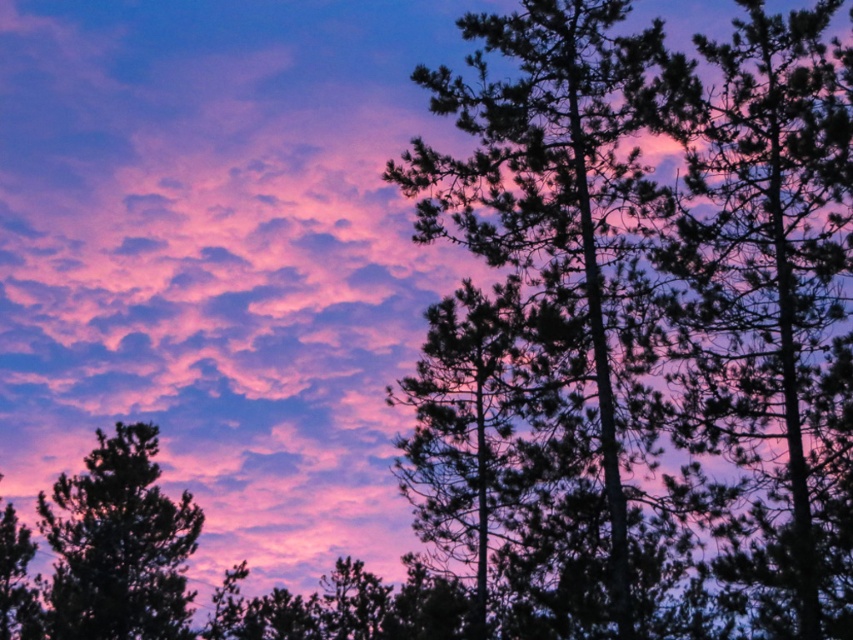
Does point (780, 476) come closer to viewer compared to point (144, 492)?

That is True.

Is black textured tree at center positioned in front of green matte tree at lower left?

Yes, it is in front of green matte tree at lower left.

Which is in front, point (816, 468) or point (171, 573)?

Point (816, 468) is in front.

Identify the location of black textured tree at center. (770, 294).

Which of these two, black textured tree at center or silhouette tree at center, stands taller?

black textured tree at center

Looking at this image, who is positioned more to the left, black textured tree at center or silhouette tree at center?

silhouette tree at center

Where is `black textured tree at center`? The width and height of the screenshot is (853, 640). black textured tree at center is located at coordinates (770, 294).

Consider the image. Which is below, silhouette tree at center or green matte tree at lower left?

green matte tree at lower left is lower down.

Between point (485, 65) and point (125, 592), which one is positioned in front?

Positioned in front is point (485, 65).

At what (x,y) coordinates should I click in order to perform the action: click on silhouette tree at center. Please return your answer as a coordinate pair (x, y). The image size is (853, 640). Looking at the image, I should click on 556,227.